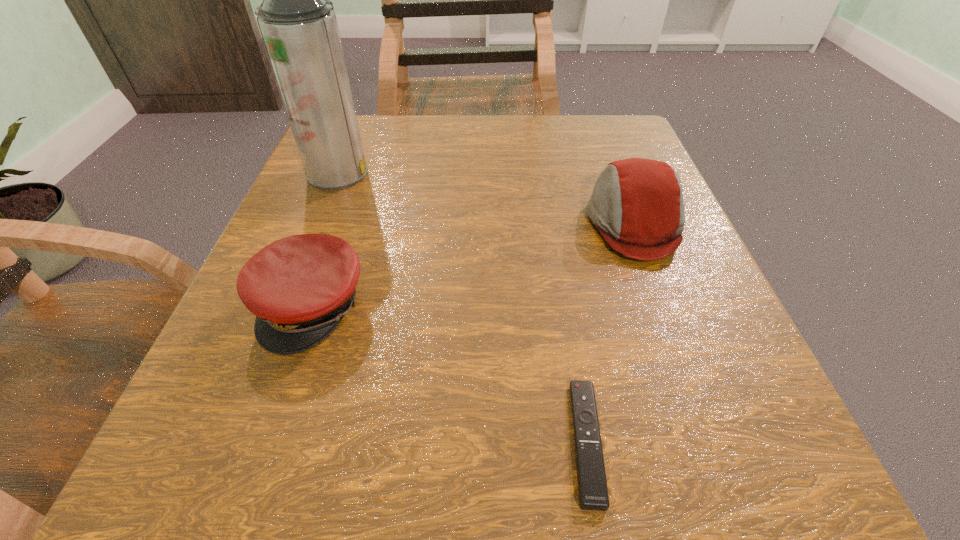
I want to click on vacant area at the near edge, so click(617, 443).

Identify the location of free space at the left edge. The height and width of the screenshot is (540, 960). (369, 212).

I want to click on vacant space at the right edge of the desktop, so click(x=664, y=276).

Identify the location of blank space at the far right corner of the desktop. The width and height of the screenshot is (960, 540). (584, 120).

This screenshot has height=540, width=960. Find the location of `empty space that is in between the second tallest object and the second shortest object`. empty space that is in between the second tallest object and the second shortest object is located at coordinates (473, 265).

You are a GUI agent. You are given a task and a screenshot of the screen. Output one action in this format:
    pyautogui.click(x=<x>, y=<y>)
    Task: Click on the vacant area between the third tallest object and the remote control
    
    Given the screenshot: What is the action you would take?
    pyautogui.click(x=449, y=374)

The height and width of the screenshot is (540, 960). I want to click on vacant space in between the tallest object and the rightmost object, so click(x=486, y=198).

Find the location of `free area in between the second object from right to left and the tallest object`. free area in between the second object from right to left and the tallest object is located at coordinates (462, 307).

Identify the location of empty space that is in between the rightmost object and the tallest object. This screenshot has height=540, width=960. (486, 198).

You are a GUI agent. You are given a task and a screenshot of the screen. Output one action in this format:
    pyautogui.click(x=<x>, y=<y>)
    Task: Click on the free area in between the tallest object and the nearest object
    This screenshot has width=960, height=540.
    Given the screenshot: What is the action you would take?
    pyautogui.click(x=462, y=307)